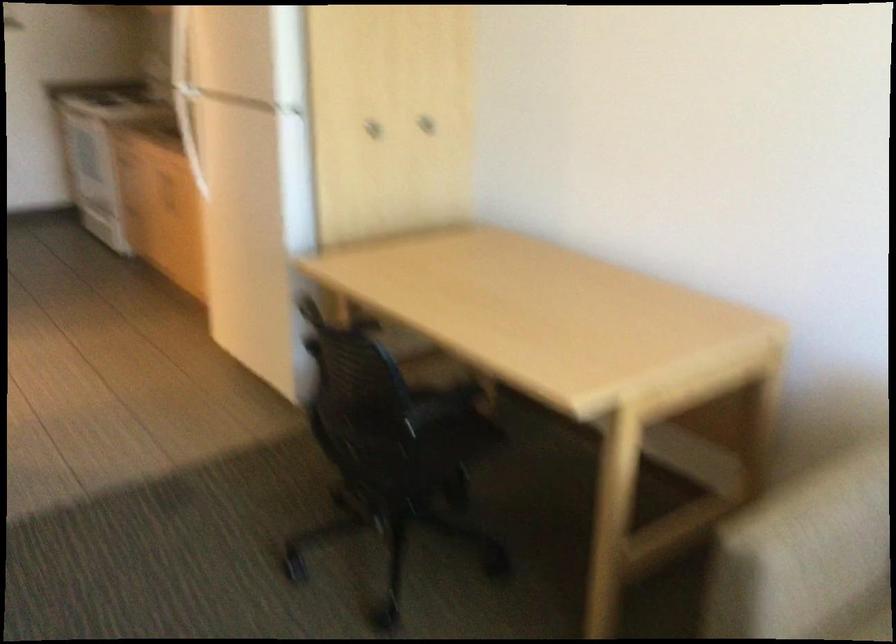
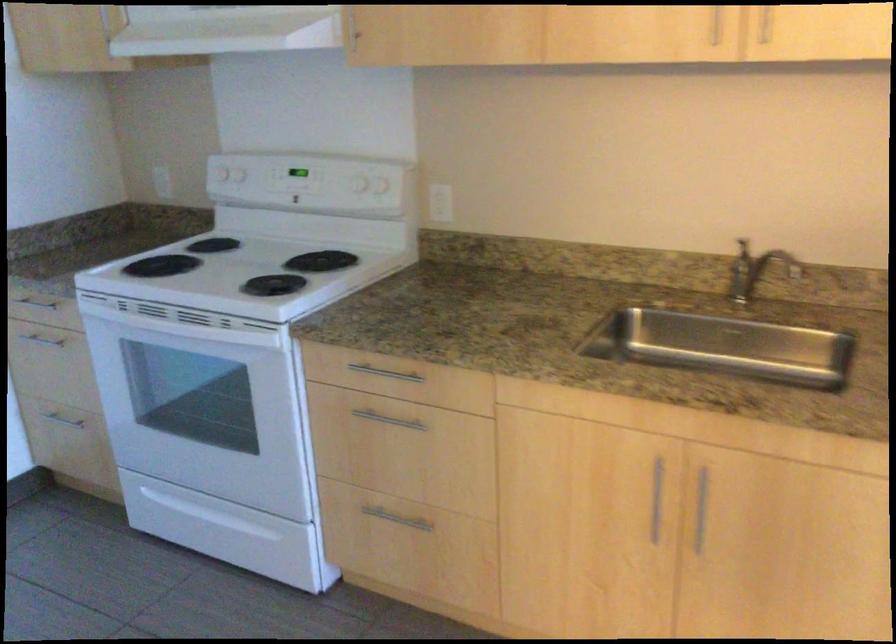
In a continuous first-person perspective shot, in which direction is the camera moving?

The movement direction of the cameraman is left, forward.